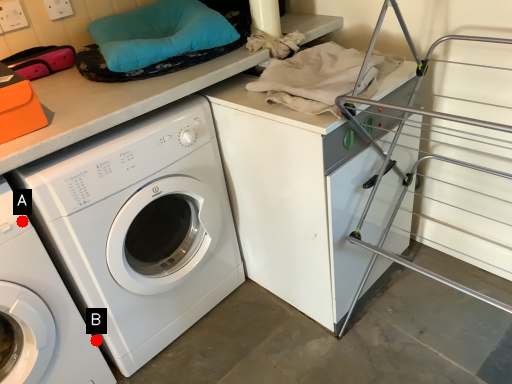
Question: Two points are circled on the image, labeled by A and B beside each circle. Which point is farther to the camera?

Choices:
 (A) A is further
 (B) B is further

Answer: (B)